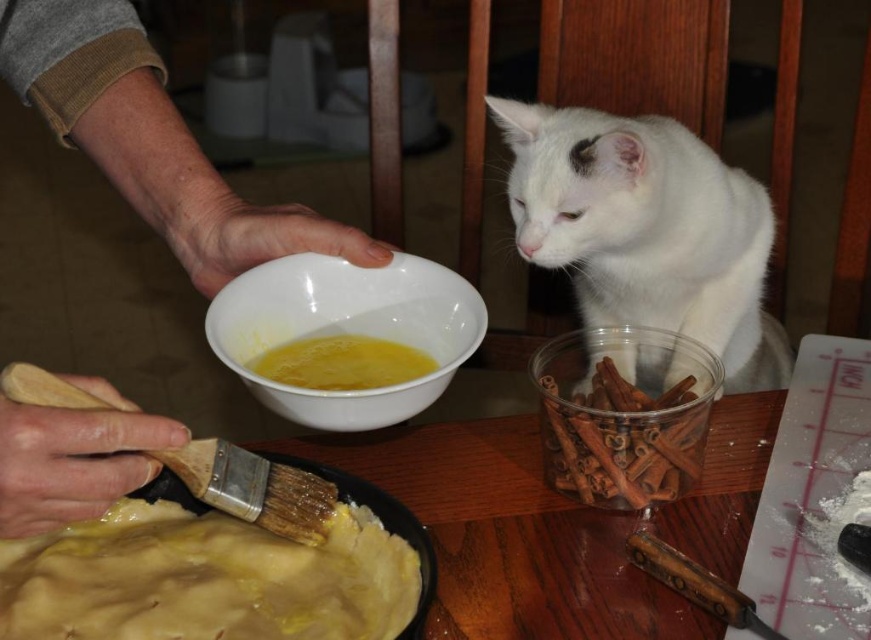
You are a chef preparing a pie and need to place both the yellow matte pie crust at lower left and the brown translucent plastic container at lower right into an oven. The oven has a shelf that can only accommodate items smaller than the container. Can both items fit on the shelf?

The yellow matte pie crust at lower left has a smaller size compared to the brown translucent plastic container at lower right. Since the oven shelf can only accommodate items smaller than the container, the pie crust can fit, but the container cannot.

You are a chef who needs to reach both the brown translucent plastic container at lower right and the wooden bristles at lower left from your current position. If your arm can comfortably reach 20 centimeters, can you grab both items without moving your body?

The distance between the brown translucent plastic container at lower right and wooden bristles at lower left is 20.01 centimeters. Since your arm can reach 20 centimeters, you cannot comfortably grab both items without moving your body because the distance exceeds your reach by 0.01 centimeters.

You are a chef in a kitchen. You see a point at coordinate (206, 579). What object is this point located on?

The point at coordinate (206, 579) is located on the yellow matte pie crust at lower left.